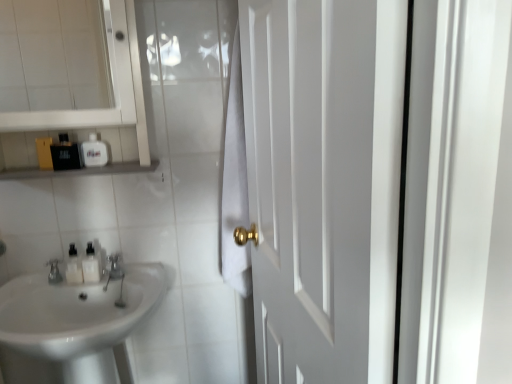
Identify the location of free spot to the right of white glossy soap dispenser at left, the 2th toiletry in the bottom-to-top sequence. This screenshot has width=512, height=384. (141, 264).